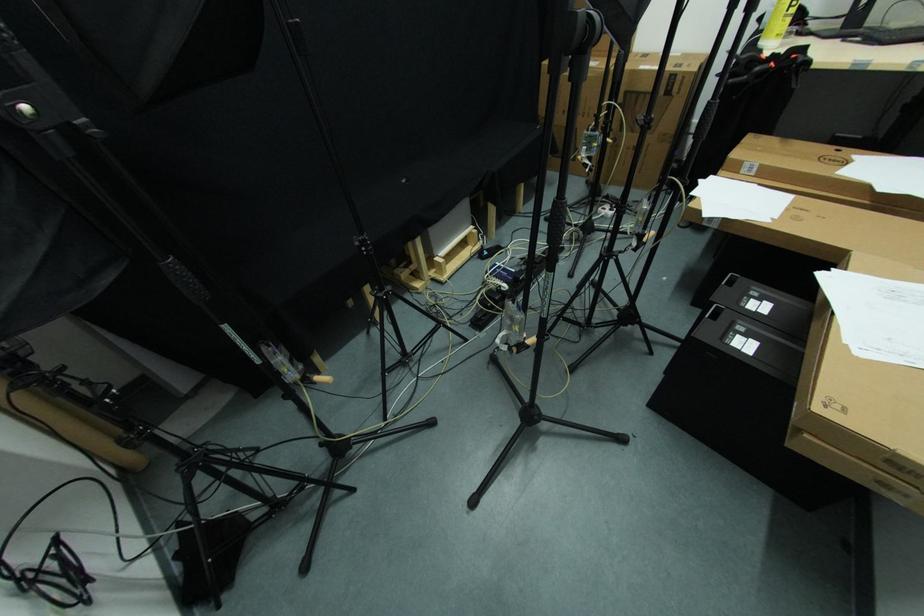
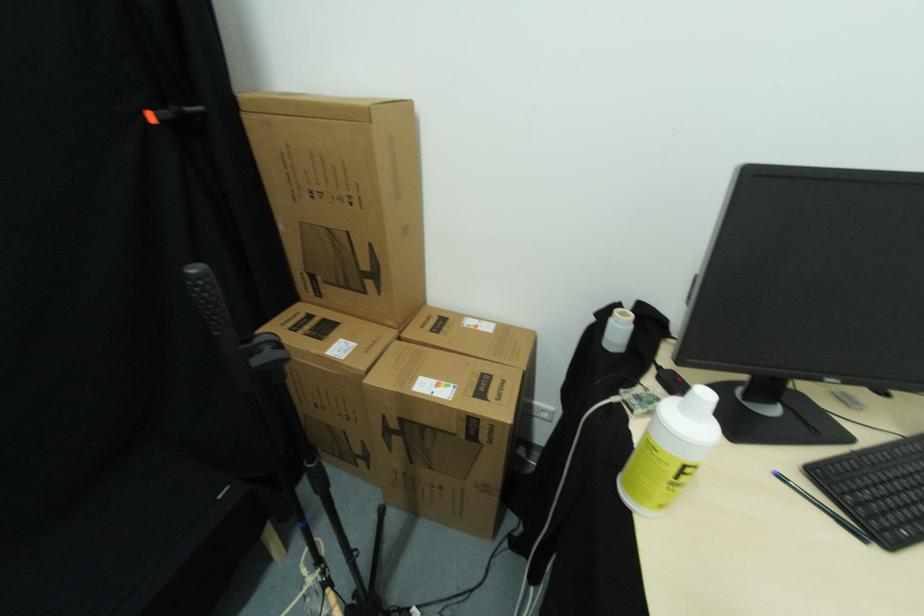
The point at (845, 43) is marked in the first image. Where is the corresponding point in the second image?

(784, 479)